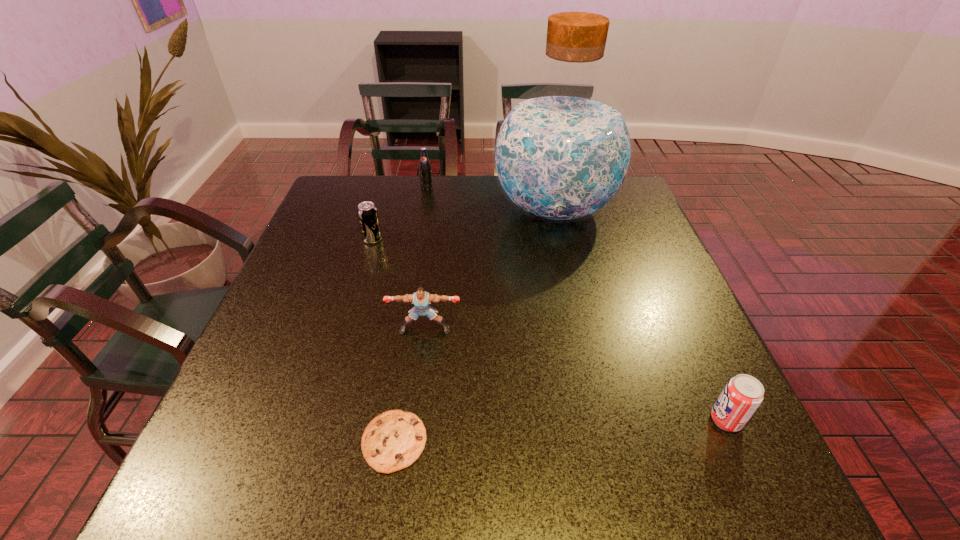
I want to click on vacant space positioned on the right of the tallest object, so click(634, 209).

This screenshot has width=960, height=540. In order to click on vacant space located on the front label of the farthest soda can in this screenshot , I will do `click(413, 269)`.

This screenshot has height=540, width=960. I want to click on free spot located on the front-facing side of the puncher, so pos(414,418).

What are the coordinates of `free space located on the front of the leftmost soda can` in the screenshot? It's located at (336, 362).

Find the location of a particular element. vacant space positioned 0.340m on the left of the rightmost object is located at coordinates (524, 420).

Where is `vacant space situated 0.340m on the right of the cookie`? The image size is (960, 540). vacant space situated 0.340m on the right of the cookie is located at coordinates (620, 442).

You are a GUI agent. You are given a task and a screenshot of the screen. Output one action in this format:
    pyautogui.click(x=<x>, y=<y>)
    Task: Click on the water jug that is positioned at the far edge
    This screenshot has height=540, width=960.
    Given the screenshot: What is the action you would take?
    pyautogui.click(x=562, y=152)

This screenshot has height=540, width=960. Find the location of `pop present at the far edge`. pop present at the far edge is located at coordinates tap(425, 169).

In order to click on object located at the near edge in this screenshot , I will do `click(393, 440)`.

What are the coordinates of `object at the left edge` in the screenshot? It's located at (367, 212).